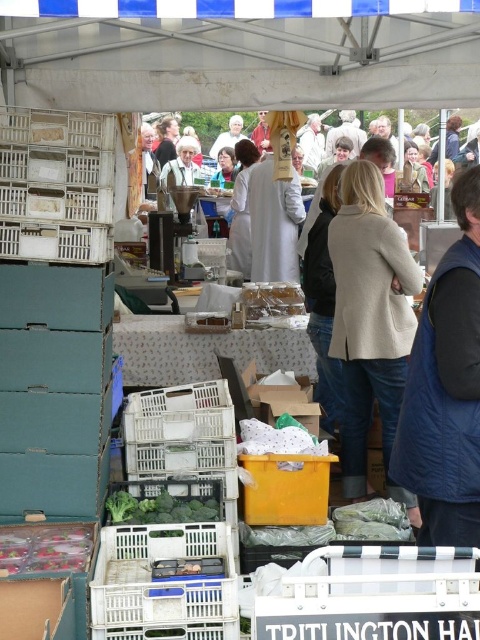
Question: Does white plastic crate at left have a smaller size compared to white plastic crate at lower left?

Choices:
 (A) no
 (B) yes

Answer: (B)

Question: Does white plastic crate at left have a smaller size compared to white plastic crate at lower left?

Choices:
 (A) yes
 (B) no

Answer: (A)

Question: Is beige wool coat at center below translucent plastic bag at lower left?

Choices:
 (A) no
 (B) yes

Answer: (A)

Question: Based on their relative distances, which object is farther from the white plastic crate at lower left?

Choices:
 (A) white plastic crate at left
 (B) translucent plastic bag at center
 (C) beige wool coat at center
 (D) blue padded vest at right

Answer: (B)

Question: Which point is farther to the camera?

Choices:
 (A) (451, 477)
 (B) (417, 268)
 (C) (249, 316)

Answer: (C)

Question: Among these objects, which one is farthest from the camera?

Choices:
 (A) beige wool coat at center
 (B) white plastic crate at left

Answer: (A)